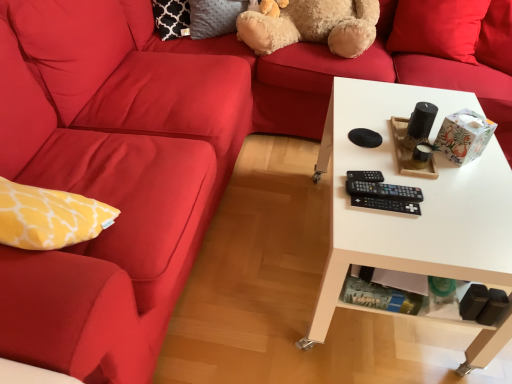
Identify the location of vacant space to the right of black plastic remote at center, the first control from the back. (421, 182).